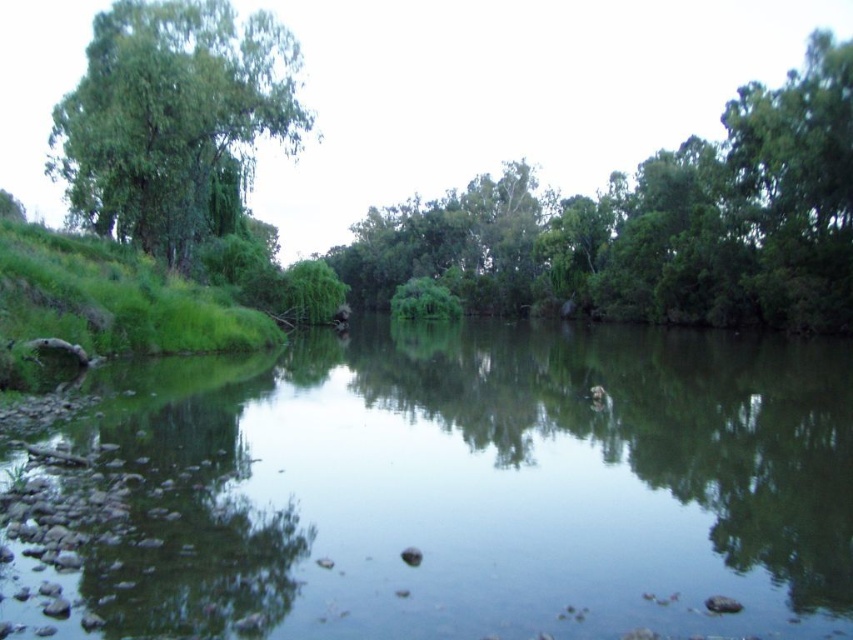
Question: In this image, where is green grassy river at center located relative to green leafy tree at center?

Choices:
 (A) left
 (B) right

Answer: (A)

Question: Can you confirm if green grassy river at center is positioned below green leafy tree at center?

Choices:
 (A) no
 (B) yes

Answer: (B)

Question: Among these points, which one is farthest from the camera?

Choices:
 (A) click(202, 186)
 (B) click(605, 244)

Answer: (B)

Question: Is green leafy tree at center below green leafy tree at left?

Choices:
 (A) no
 (B) yes

Answer: (A)

Question: Which object is the farthest from the green grassy river at center?

Choices:
 (A) green leafy tree at center
 (B) green leafy tree at left

Answer: (A)

Question: Which point is farther to the camera?

Choices:
 (A) green leafy tree at left
 (B) green grassy river at center

Answer: (A)